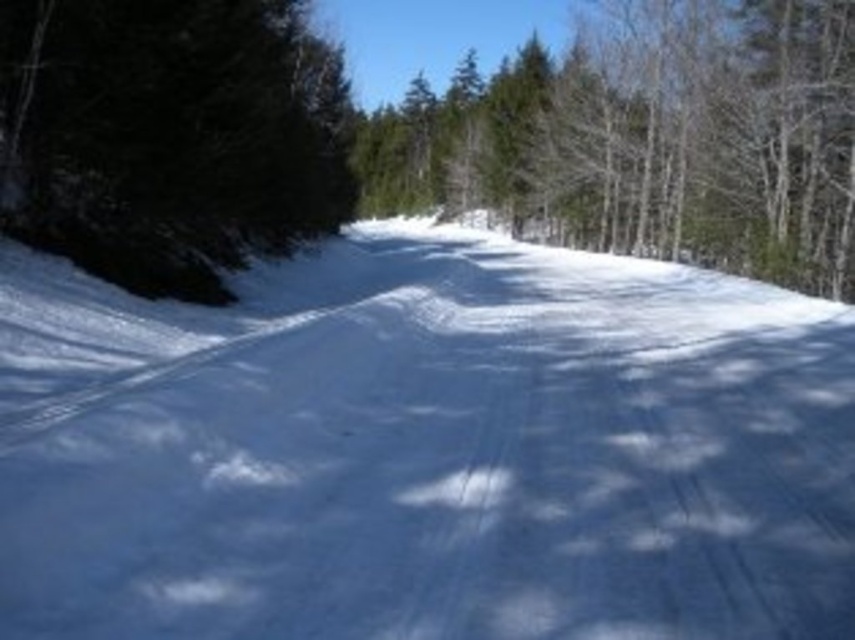
You are a skier navigating a snowy path flanked by trees. You see a green matte tree at center and a dark green evergreen at left. Which tree is closer to your left side?

The dark green evergreen at left is closer to your left side because it is positioned to the left of the green matte tree at center.

You are a skier planning to take a shortcut through the trees. You see the green matte tree at center and the dark green evergreen at left. Which tree is closer to you as you approach the path?

The green matte tree at center is closer because the dark green evergreen at left is behind it.